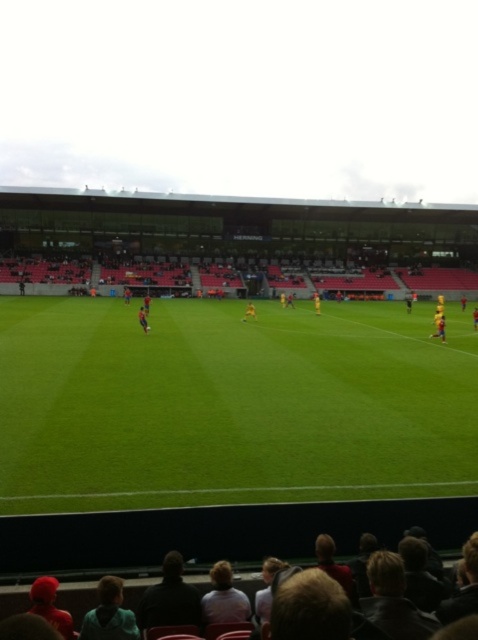
Question: Which of the following is the farthest from the observer?

Choices:
 (A) matte black jersey at center
 (B) black fabric at lower center
 (C) dark blue shirt at lower left

Answer: (A)

Question: Which object appears farthest from the camera in this image?

Choices:
 (A) green grass football field at center
 (B) blonde hair at lower center

Answer: (A)

Question: Does green grass football field at center have a smaller size compared to black fabric at lower center?

Choices:
 (A) yes
 (B) no

Answer: (B)

Question: Is leather jacket at lower right to the left of dark blue shirt at lower left from the viewer's perspective?

Choices:
 (A) yes
 (B) no

Answer: (B)

Question: Which point is closer to the camera?

Choices:
 (A) (333, 480)
 (B) (251, 314)

Answer: (A)

Question: Does matte black jersey at center appear on the left side of yellow jersey at center?

Choices:
 (A) yes
 (B) no

Answer: (A)